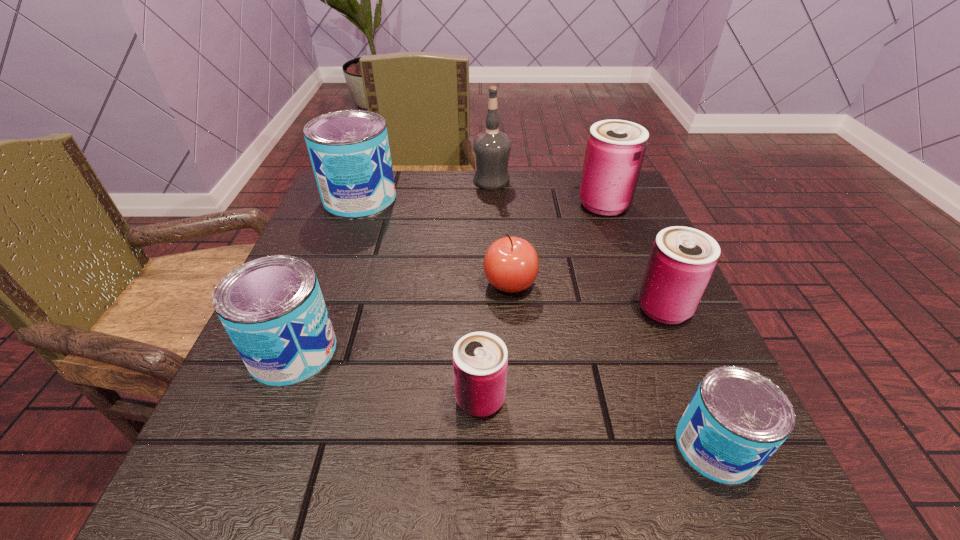
Locate an element on the screen. This screenshot has width=960, height=540. vodka is located at coordinates (491, 148).

Find the location of a particular element. Image resolution: width=960 pixels, height=540 pixels. the biggest blue can is located at coordinates (349, 150).

The width and height of the screenshot is (960, 540). I want to click on the farthest pink can, so click(x=615, y=150).

The height and width of the screenshot is (540, 960). Find the location of `the second farthest pink can`. the second farthest pink can is located at coordinates (682, 259).

Image resolution: width=960 pixels, height=540 pixels. What are the coordinates of `the second nearest blue can` in the screenshot? It's located at tap(272, 308).

At what (x,y) coordinates should I click in order to perform the action: click on apple. Please return your answer as a coordinate pair (x, y). Image resolution: width=960 pixels, height=540 pixels. Looking at the image, I should click on (511, 264).

Where is `the smallest pink can`? the smallest pink can is located at coordinates (480, 359).

You are a GUI agent. You are given a task and a screenshot of the screen. Output one action in this format:
    pyautogui.click(x=<x>, y=<y>)
    Task: Click on the leftmost pink can
    The height and width of the screenshot is (540, 960).
    Given the screenshot: What is the action you would take?
    pyautogui.click(x=480, y=359)

You are a GUI agent. You are given a task and a screenshot of the screen. Output one action in this format:
    pyautogui.click(x=<x>, y=<y>)
    Task: Click on the rightmost blue can
    Image resolution: width=960 pixels, height=540 pixels.
    Given the screenshot: What is the action you would take?
    pyautogui.click(x=737, y=418)

This screenshot has height=540, width=960. What are the coordinates of `the nearest blue can` in the screenshot? It's located at (737, 418).